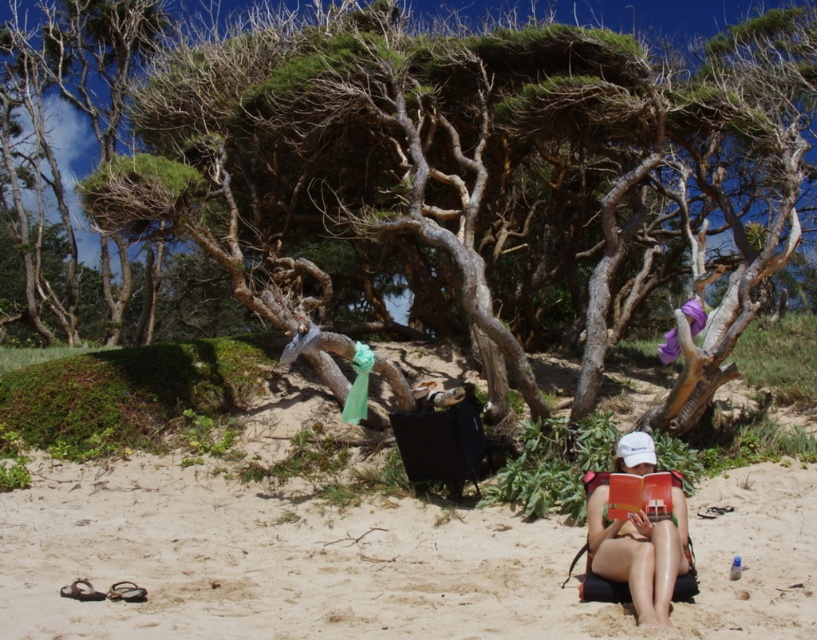
You are a photographer planning to take a photo of the tan skin bikini at lower right while ensuring the brown textured tree at center does not block the view. Can you position yourself in a way that the tree is not in front of the bikini?

The brown textured tree at center is positioned over tan skin bikini at lower right, so if you move to the side opposite of the tree, you can capture the bikini without the tree obstructing the view.

You are a drone operator trying to capture a photo of the beach scene. You need to position your drone so that it can fly from point A to point B without blocking the view of the person in the black folding chair. Given that point A is at coordinates point (784,573) and point B is at coordinates point (659,609), which point should the drone start from to ensure it doesn t block the view?

Point (784,573) is behind point (659,609). Therefore, the drone should start from point (659,609) to avoid blocking the view of the person in the black folding chair.